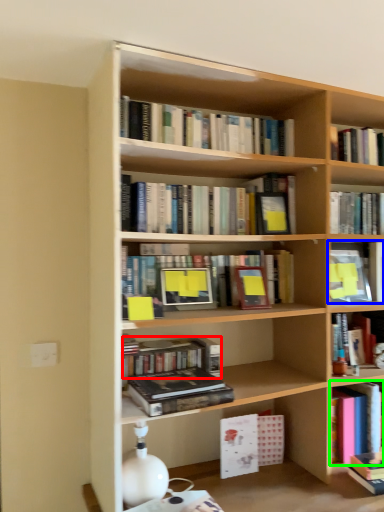
Question: Considering the real-world distances, which object is farthest from book (highlighted by a red box)? book (highlighted by a blue box) or book (highlighted by a green box)?

Choices:
 (A) book
 (B) book

Answer: (B)